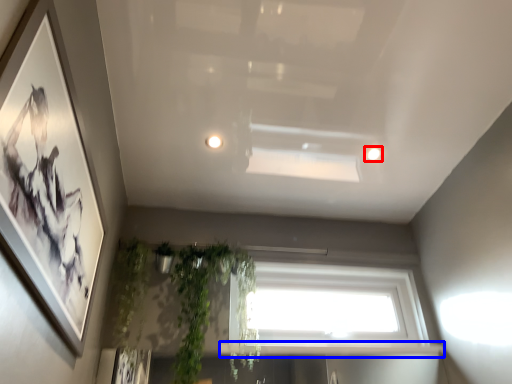
Question: Which object is further to the camera taking this photo, lighting (highlighted by a red box) or window sill (highlighted by a blue box)?

Choices:
 (A) lighting
 (B) window sill

Answer: (A)